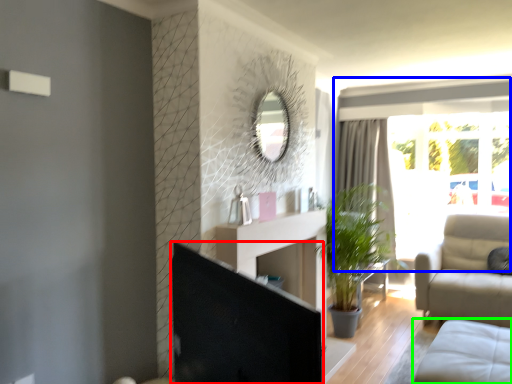
Question: Estimate the real-world distances between objects in this image. Which object is closer to screen door (highlighted by a red box), window (highlighted by a blue box) or studio couch (highlighted by a green box)?

Choices:
 (A) window
 (B) studio couch

Answer: (B)